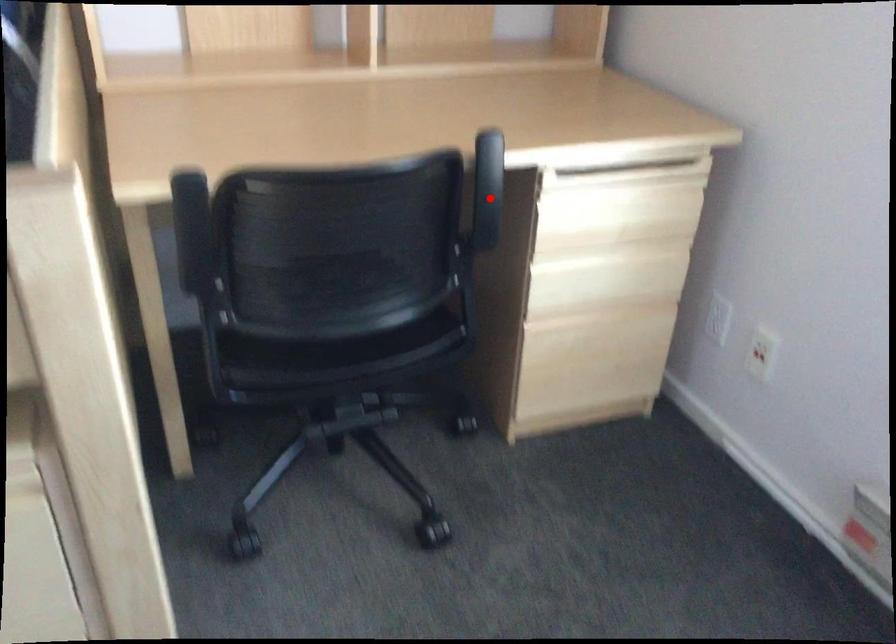
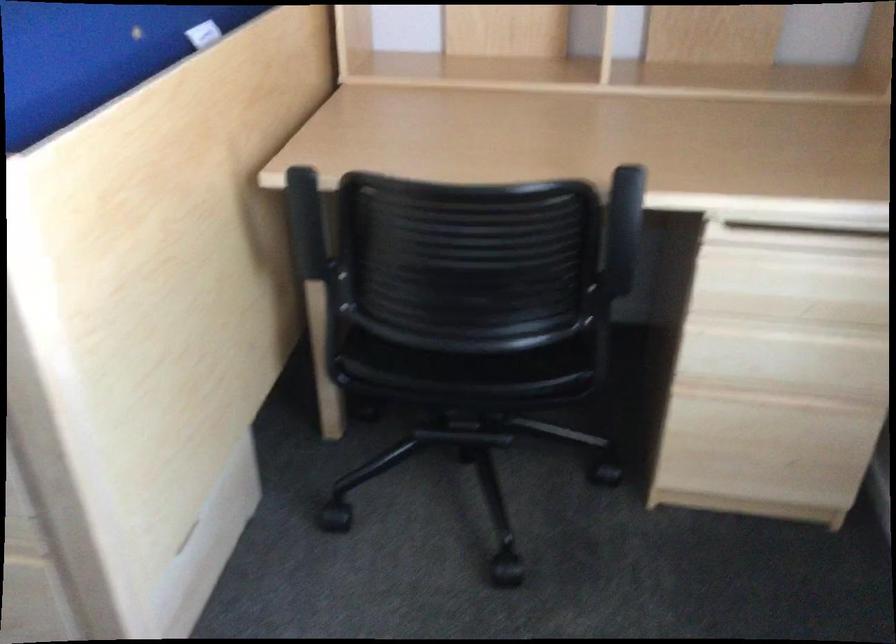
Find the pixel in the second image that matches the highlighted location in the first image.

(625, 240)